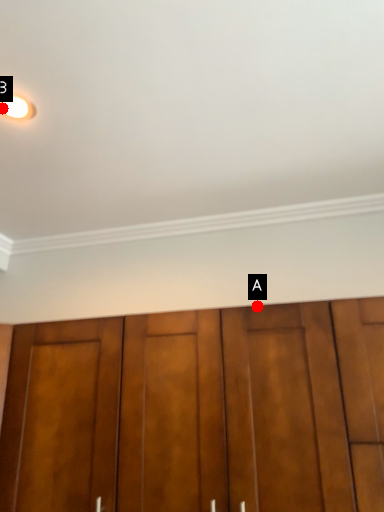
Question: Two points are circled on the image, labeled by A and B beside each circle. Which point is farther to the camera?

Choices:
 (A) A is further
 (B) B is further

Answer: (A)